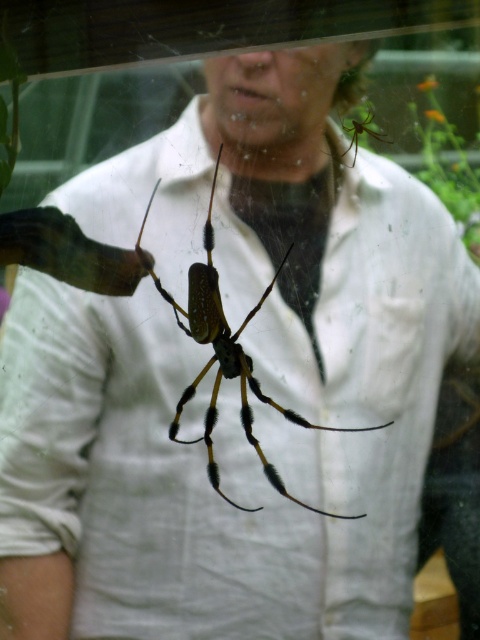
Question: Is shiny metallic spider at center to the right of shiny green spider at upper right from the viewer's perspective?

Choices:
 (A) yes
 (B) no

Answer: (B)

Question: Among these objects, which one is farthest from the camera?

Choices:
 (A) shiny green spider at upper right
 (B) shiny metallic spider at center

Answer: (B)

Question: Can you confirm if shiny metallic spider at center is positioned to the left of shiny green spider at upper right?

Choices:
 (A) no
 (B) yes

Answer: (B)

Question: Does shiny metallic spider at center appear on the left side of shiny green spider at upper right?

Choices:
 (A) yes
 (B) no

Answer: (A)